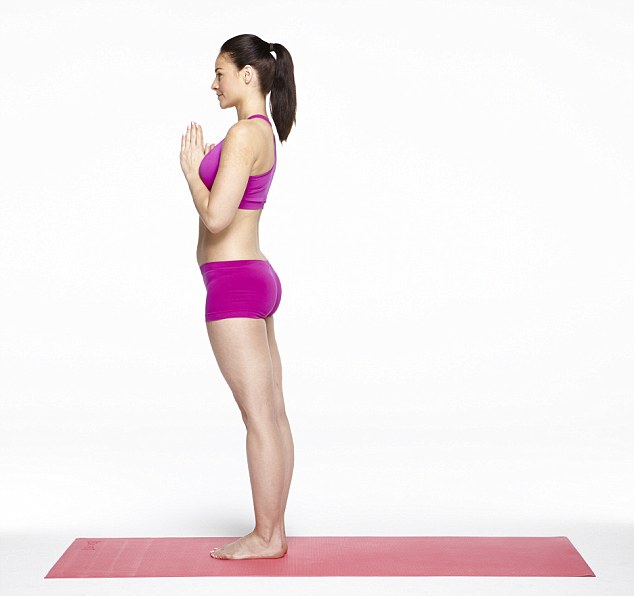
This screenshot has height=596, width=634. In order to click on yoga mat in this screenshot , I will do `click(364, 557)`.